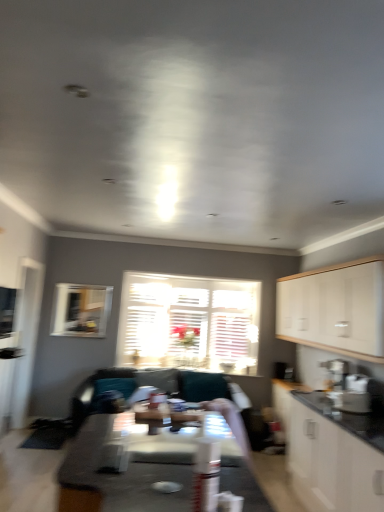
Identify the location of free space above smooth white table at center, which is counted as the second table, starting from the top (from a real-world perspective). [157, 455].